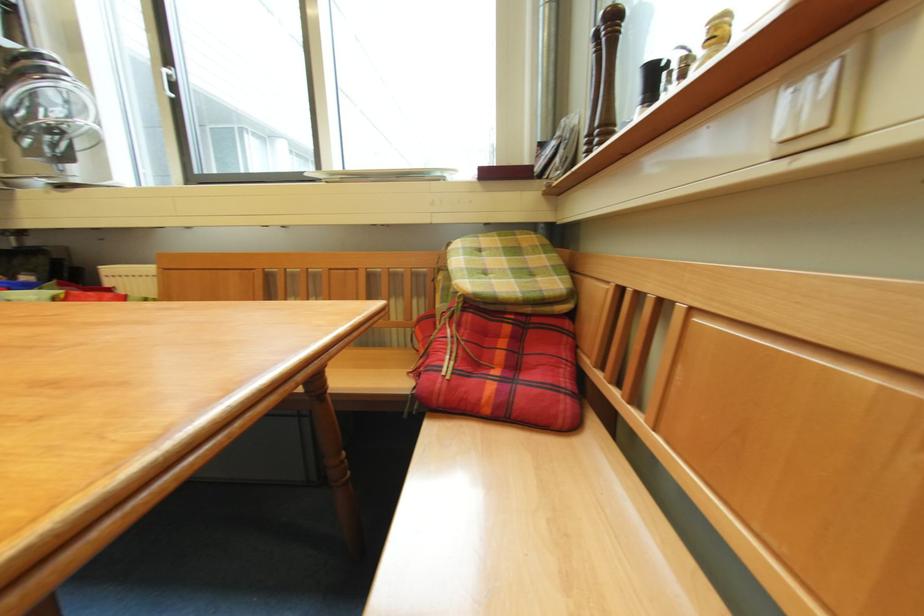
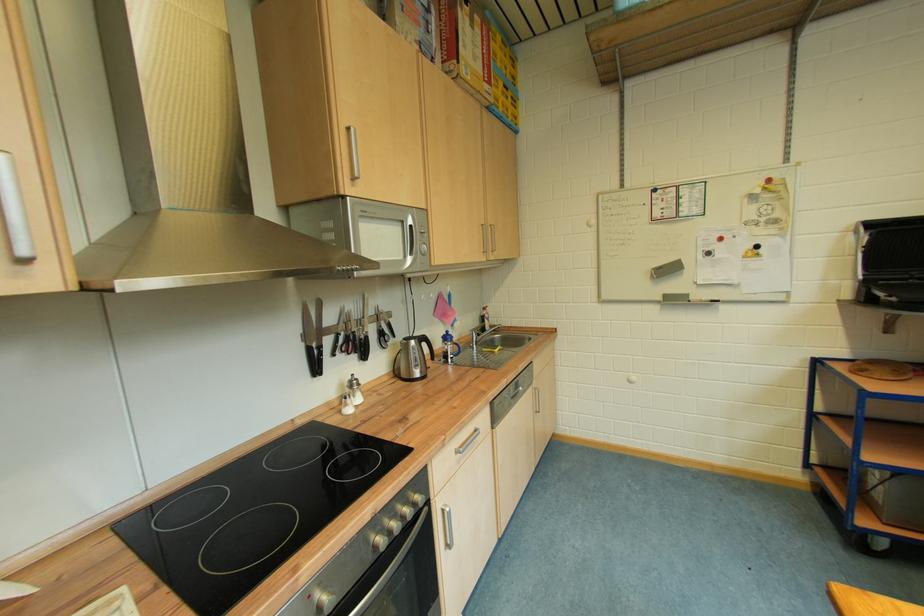
Question: The camera is either moving clockwise (left) or counter-clockwise (right) around the object. The first image is from the beginning of the video and the second image is from the end. Is the camera moving left or right when shooting the video?

Choices:
 (A) Left
 (B) Right

Answer: (B)